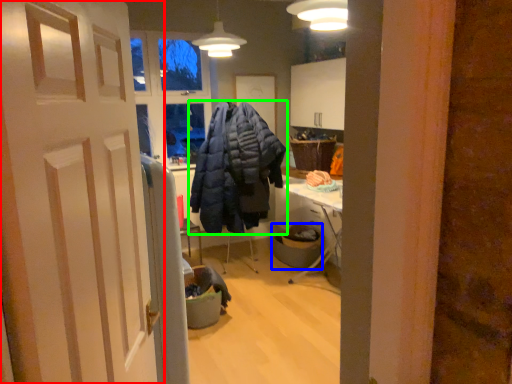
Question: Estimate the real-world distances between objects in this image. Which object is farther from door (highlighted by a red box), trash bin/can (highlighted by a blue box) or jacket (highlighted by a green box)?

Choices:
 (A) trash bin/can
 (B) jacket

Answer: (A)